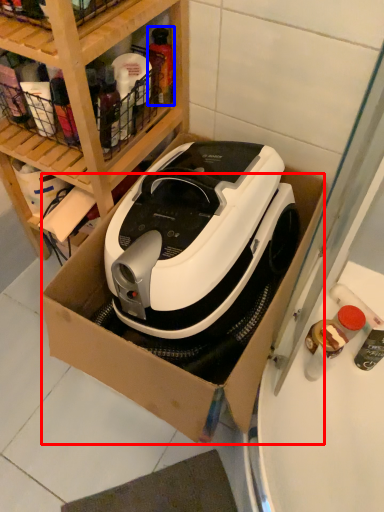
Question: Which object appears closest to the camera in this image, cardboard box (highlighted by a red box) or bottle (highlighted by a blue box)?

Choices:
 (A) cardboard box
 (B) bottle

Answer: (A)